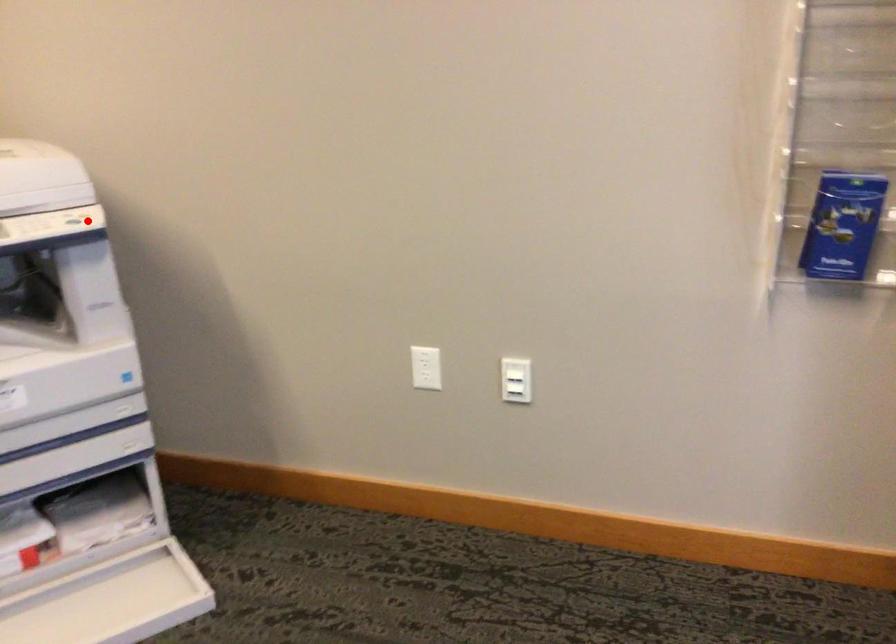
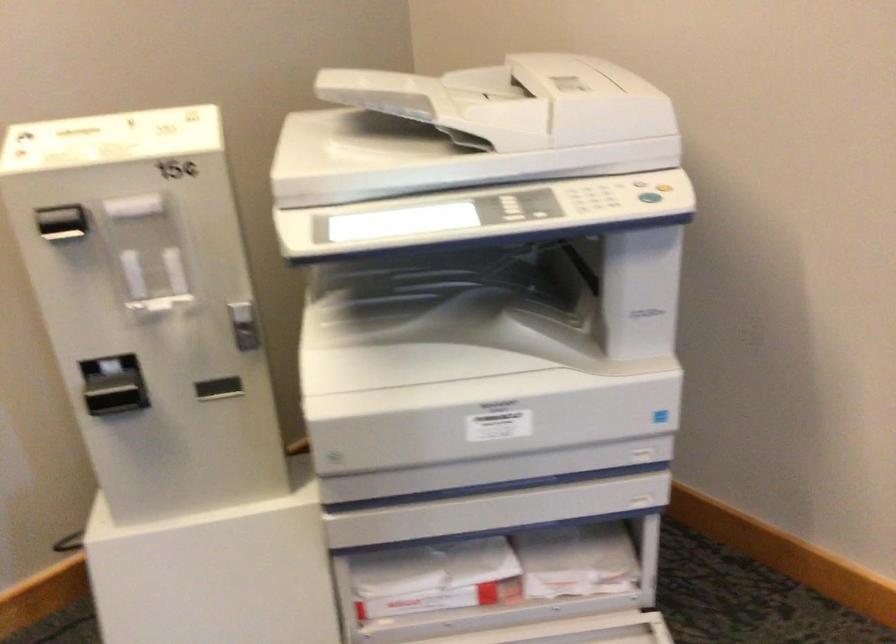
Question: I am providing you with two images of the same scene from different viewpoints. A red point is marked on the first image. Can you still see the location of the red point in image 2?

Choices:
 (A) Yes
 (B) No

Answer: (A)